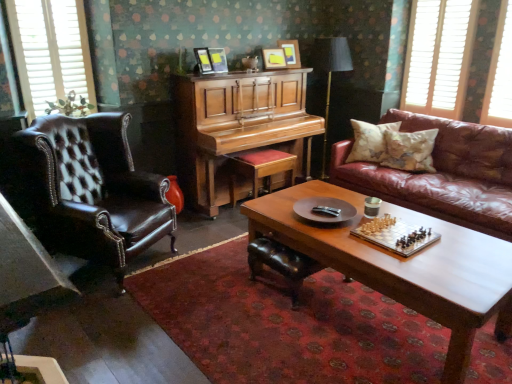
Where is `vacant point above white wooden blinds at upper right, acting as the 2th window starting from the left (from a real-world perspective)`? Image resolution: width=512 pixels, height=384 pixels. vacant point above white wooden blinds at upper right, acting as the 2th window starting from the left (from a real-world perspective) is located at coordinates (444, 0).